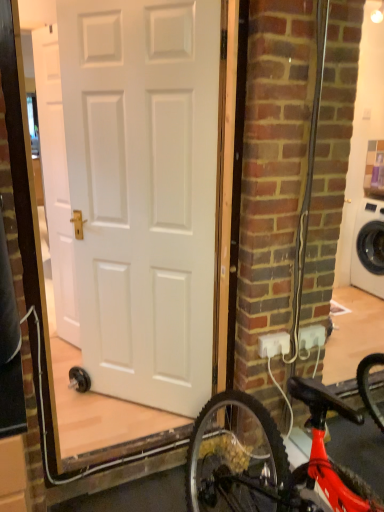
What do you see at coordinates (276, 461) in the screenshot? Image resolution: width=384 pixels, height=512 pixels. I see `shiny red bicycle at lower right` at bounding box center [276, 461].

Image resolution: width=384 pixels, height=512 pixels. I want to click on shiny red bicycle at lower right, so click(276, 461).

Find the location of a particular element. The image size is (384, 512). white matte door at center, the second door in the left-to-right sequence is located at coordinates (144, 192).

The height and width of the screenshot is (512, 384). What are the coordinates of `shiny red bicycle at lower right` in the screenshot? It's located at (276, 461).

Is white plastic outlet at lower right to the right of white matte door at upper left, which is counted as the 1th door, starting from the back, from the viewer's perspective?

Correct, you'll find white plastic outlet at lower right to the right of white matte door at upper left, which is counted as the 1th door, starting from the back.

Is white plastic outlet at lower right completely or partially outside of white matte door at upper left, acting as the 2th door starting from the right?

Yes, white plastic outlet at lower right is not within white matte door at upper left, acting as the 2th door starting from the right.

From a real-world perspective, who is located higher, white plastic outlet at lower right or white matte door at upper left, which ranks as the 1th door in left-to-right order?

white matte door at upper left, which ranks as the 1th door in left-to-right order, is physically above.

Between white plastic outlet at lower right and white matte door at center, the first door positioned from the front, which one has larger size?

white matte door at center, the first door positioned from the front.

From the image's perspective, who appears lower, white plastic outlet at lower right or white matte door at center, which is counted as the 1th door, starting from the right?

white plastic outlet at lower right, from the image's perspective.

Which object is thinner, white plastic outlet at lower right or white matte door at center, the first door positioned from the front?

Thinner between the two is white plastic outlet at lower right.

From a real-world perspective, relative to white matte door at center, which is counted as the 1th door, starting from the right, is white plastic outlet at lower right vertically above or below?

Clearly, from a real-world perspective, white plastic outlet at lower right is below white matte door at center, which is counted as the 1th door, starting from the right.

Is white plastic outlet at lower right at the right side of shiny red bicycle at lower right?

No.

What's the angular difference between white plastic outlet at lower right and shiny red bicycle at lower right's facing directions?

They differ by 88.8 degrees in their facing directions.

The image size is (384, 512). Find the location of `bicycle on the right of white plastic outlet at lower right`. bicycle on the right of white plastic outlet at lower right is located at coordinates (276, 461).

From a real-world perspective, between white plastic outlet at lower right and shiny red bicycle at lower right, who is vertically higher?

white plastic outlet at lower right, from a real-world perspective.

Which object is positioned more to the left, white matte door at center, the second door in the left-to-right sequence, or shiny red bicycle at lower right?

Positioned to the left is white matte door at center, the second door in the left-to-right sequence.

Is point (137, 152) behind point (335, 470)?

Yes, point (137, 152) is behind point (335, 470).

How many degrees apart are the facing directions of white matte door at center, the first door positioned from the front, and shiny red bicycle at lower right?

They differ by 43.4 degrees in their facing directions.

Considering the relative sizes of white matte door at center, the second door in the left-to-right sequence, and shiny red bicycle at lower right in the image provided, is white matte door at center, the second door in the left-to-right sequence, taller than shiny red bicycle at lower right?

Indeed, white matte door at center, the second door in the left-to-right sequence, has a greater height compared to shiny red bicycle at lower right.

Looking at this image, which is closer, (58, 139) or (228, 402)?

Point (58, 139) is positioned farther from the camera compared to point (228, 402).

Is white matte door at upper left, which is the second door in front-to-back order, to the right of shiny red bicycle at lower right from the viewer's perspective?

No, white matte door at upper left, which is the second door in front-to-back order, is not to the right of shiny red bicycle at lower right.

Is white matte door at upper left, which ranks as the 1th door in left-to-right order, next to shiny red bicycle at lower right?

No, white matte door at upper left, which ranks as the 1th door in left-to-right order, is not touching shiny red bicycle at lower right.

Is white matte door at upper left, which is counted as the 1th door, starting from the back, positioned far away from white matte door at center, the second door in the left-to-right sequence?

white matte door at upper left, which is counted as the 1th door, starting from the back, is near white matte door at center, the second door in the left-to-right sequence, not far away.

Is white matte door at upper left, which is the second door in front-to-back order, to the left or to the right of white matte door at center, positioned as the second door in back-to-front order, in the image?

white matte door at upper left, which is the second door in front-to-back order, is positioned on white matte door at center, positioned as the second door in back-to-front order,'s left side.

Is white matte door at upper left, which ranks as the 1th door in left-to-right order, outside of white matte door at center, positioned as the second door in back-to-front order?

Absolutely, white matte door at upper left, which ranks as the 1th door in left-to-right order, is external to white matte door at center, positioned as the second door in back-to-front order.

From a real-world perspective, relative to white matte door at center, which is counted as the 1th door, starting from the right, is white matte door at upper left, which ranks as the 1th door in left-to-right order, vertically above or below?

white matte door at upper left, which ranks as the 1th door in left-to-right order, is situated lower than white matte door at center, which is counted as the 1th door, starting from the right, in the real world.

From the picture: Choose the correct answer: Is shiny red bicycle at lower right inside white plastic outlet at lower right or outside it?

The correct answer is: outside.

Is shiny red bicycle at lower right in front of or behind white plastic outlet at lower right in the image?

In the image, shiny red bicycle at lower right appears in front of white plastic outlet at lower right.

How distant is shiny red bicycle at lower right from white plastic outlet at lower right?

shiny red bicycle at lower right and white plastic outlet at lower right are 19.04 inches apart.

Is shiny red bicycle at lower right thinner than white plastic outlet at lower right?

No, shiny red bicycle at lower right is not thinner than white plastic outlet at lower right.

Find the location of a particular element. This screenshot has width=384, height=512. electric outlet that appears below the white matte door at upper left, which ranks as the 1th door in left-to-right order (from a real-world perspective) is located at coordinates (273, 344).

The image size is (384, 512). Identify the location of door that appears in front of the white plastic outlet at lower right. (144, 192).

From the image, which object appears to be farther from white matte door at center, which is counted as the 1th door, starting from the right, white plastic outlet at lower right or shiny red bicycle at lower right?

white plastic outlet at lower right.

From the picture: Looking at the image, which one is located closer to white matte door at upper left, which ranks as the 1th door in left-to-right order, white matte door at center, positioned as the second door in back-to-front order, or shiny red bicycle at lower right?

white matte door at center, positioned as the second door in back-to-front order.

Estimate the real-world distances between objects in this image. Which object is closer to white plastic outlet at lower right, white matte door at upper left, which ranks as the 1th door in left-to-right order, or white matte door at center, the first door positioned from the front?

white matte door at center, the first door positioned from the front.

Based on the photo, from the image, which object appears to be nearer to white matte door at upper left, which ranks as the 1th door in left-to-right order, shiny red bicycle at lower right or white plastic outlet at lower right?

shiny red bicycle at lower right is positioned closer to the anchor white matte door at upper left, which ranks as the 1th door in left-to-right order.

Considering their positions, is white plastic outlet at lower right positioned closer to white matte door at center, positioned as the second door in back-to-front order, than white matte door at upper left, acting as the 2th door starting from the right?

white matte door at upper left, acting as the 2th door starting from the right, lies closer to white matte door at center, positioned as the second door in back-to-front order, than the other object.

When comparing their distances from white matte door at upper left, which is the second door in front-to-back order, does white plastic outlet at lower right or shiny red bicycle at lower right seem further?

white plastic outlet at lower right is positioned further to the anchor white matte door at upper left, which is the second door in front-to-back order.

Estimate the real-world distances between objects in this image. Which object is further from white matte door at upper left, which is counted as the 1th door, starting from the back, white plastic outlet at lower right or white matte door at center, which is counted as the 1th door, starting from the right?

white plastic outlet at lower right is positioned further to the anchor white matte door at upper left, which is counted as the 1th door, starting from the back.

Estimate the real-world distances between objects in this image. Which object is further from shiny red bicycle at lower right, white plastic outlet at lower right or white matte door at center, the first door positioned from the front?

white matte door at center, the first door positioned from the front, lies further to shiny red bicycle at lower right than the other object.

Identify the location of electric outlet located between shiny red bicycle at lower right and white matte door at upper left, which ranks as the 1th door in left-to-right order, in the depth direction. The image size is (384, 512). (273, 344).

Image resolution: width=384 pixels, height=512 pixels. In order to click on door between white matte door at upper left, which is counted as the 1th door, starting from the back, and white plastic outlet at lower right in this screenshot , I will do `click(144, 192)`.

Find the location of a particular element. door positioned between shiny red bicycle at lower right and white plastic outlet at lower right from near to far is located at coordinates (144, 192).

What are the coordinates of `door positioned between shiny red bicycle at lower right and white matte door at upper left, acting as the 2th door starting from the right, from near to far` in the screenshot? It's located at (144, 192).